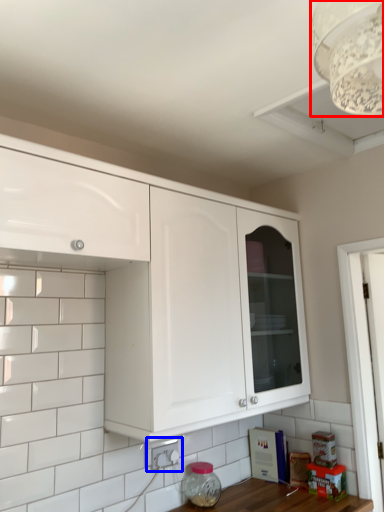
Question: Which point is further to the camera, light fixture (highlighted by a red box) or electric outlet (highlighted by a blue box)?

Choices:
 (A) light fixture
 (B) electric outlet

Answer: (B)